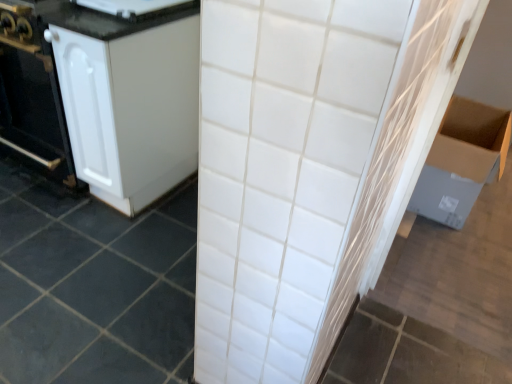
Question: Is white ceramic tile at center inside or outside of cardboard box at right?

Choices:
 (A) inside
 (B) outside

Answer: (B)

Question: Is point 28,319 closer or farther from the camera than point 437,218?

Choices:
 (A) closer
 (B) farther

Answer: (A)

Question: Estimate the real-world distances between objects in this image. Which object is farther from the white glossy refrigerator at upper left?

Choices:
 (A) white ceramic tile at center
 (B) cardboard box at right
 (C) white matte cabinet at left

Answer: (B)

Question: Which is farther from the white matte cabinet at left?

Choices:
 (A) white ceramic tile at center
 (B) cardboard box at right
 (C) white glossy refrigerator at upper left

Answer: (B)